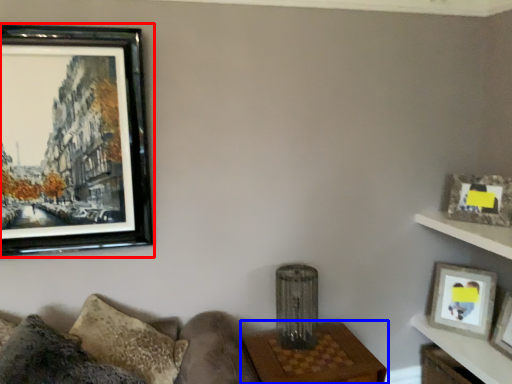
Question: Which point is further to the camera, picture frame (highlighted by a red box) or table (highlighted by a blue box)?

Choices:
 (A) picture frame
 (B) table

Answer: (B)